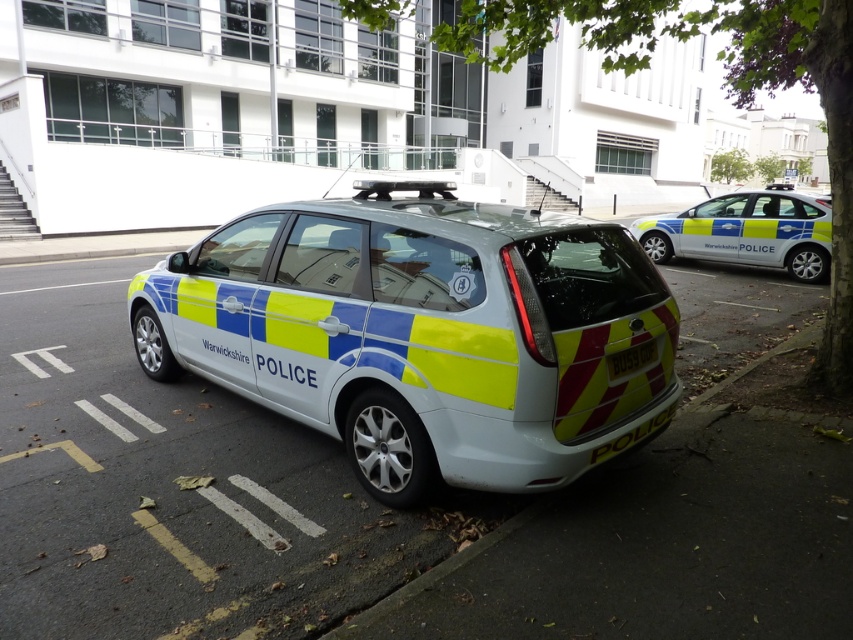
Based on the photo, you are a pedestrian standing on the sidewalk across the street from the polished blue and yellow police car at right and the white plastic license plate at rear center. Which object is closer to you?

The polished blue and yellow police car at right is closer to you because it is positioned over the white plastic license plate at rear center, meaning it is in front of it from your perspective.